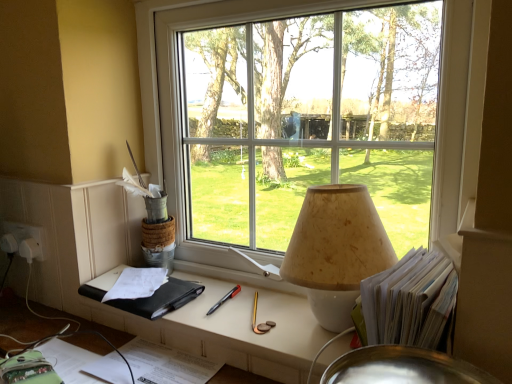
In order to face beige textured lampshade at center, should I rotate leftwards or rightwards?

To align with it, rotate right about 10.952°.

What is the approximate width of beige textured lampshade at center?

8.10 inches.

From the picture: Measure the distance between white paper stack at right and camera.

white paper stack at right is 21.95 inches from camera.

This screenshot has height=384, width=512. Find the location of `transparent glass window at center`. transparent glass window at center is located at coordinates (310, 119).

Are beige textured lampshade at center and white paper stack at right far apart?

No, there isn't a large distance between beige textured lampshade at center and white paper stack at right.

Considering the relative sizes of beige textured lampshade at center and white paper stack at right in the image provided, is beige textured lampshade at center wider than white paper stack at right?

Indeed, beige textured lampshade at center has a greater width compared to white paper stack at right.

Between beige textured lampshade at center and white paper stack at right, which one has more height?

beige textured lampshade at center is taller.

Find the location of a particular element. lamp on the left of white paper stack at right is located at coordinates (336, 250).

Considering the positions of point (325, 226) and point (446, 202), is point (325, 226) closer or farther from the camera than point (446, 202)?

Clearly, point (325, 226) is closer to the camera than point (446, 202).

Which is correct: beige textured lampshade at center is inside transparent glass window at center, or outside of it?

beige textured lampshade at center is not enclosed by transparent glass window at center.

From the image's perspective, who appears lower, beige textured lampshade at center or transparent glass window at center?

From the image's view, beige textured lampshade at center is below.

Visually, is beige textured lampshade at center positioned to the left or to the right of transparent glass window at center?

In the image, beige textured lampshade at center appears on the right side of transparent glass window at center.

Considering the relative sizes of transparent glass window at center and black leather notebook at lower left in the image provided, is transparent glass window at center bigger than black leather notebook at lower left?

Indeed, transparent glass window at center has a larger size compared to black leather notebook at lower left.

Considering the sizes of objects transparent glass window at center and black leather notebook at lower left in the image provided, who is wider, transparent glass window at center or black leather notebook at lower left?

Wider between the two is black leather notebook at lower left.

Would you say transparent glass window at center is inside or outside black leather notebook at lower left?

transparent glass window at center is located beyond the bounds of black leather notebook at lower left.

Between transparent glass window at center and black leather notebook at lower left, which one has less height?

black leather notebook at lower left is shorter.

Who is shorter, beige textured lampshade at center or black leather notebook at lower left?

Standing shorter between the two is black leather notebook at lower left.

From a real-world perspective, is beige textured lampshade at center over black leather notebook at lower left?

Yes, from a real-world perspective, beige textured lampshade at center is on top of black leather notebook at lower left.

From the image's perspective, is beige textured lampshade at center located above black leather notebook at lower left?

Yes, from the image's perspective, beige textured lampshade at center is on top of black leather notebook at lower left.

Choose the correct answer: Is beige textured lampshade at center inside black leather notebook at lower left or outside it?

beige textured lampshade at center is not inside black leather notebook at lower left, it's outside.

You are a GUI agent. You are given a task and a screenshot of the screen. Output one action in this format:
    pyautogui.click(x=<x>, y=<y>)
    Task: Click on the notebook on the left of transparent glass window at center
    The image size is (512, 384).
    Given the screenshot: What is the action you would take?
    pyautogui.click(x=161, y=299)

Which of these two, black leather notebook at lower left or transparent glass window at center, is thinner?

transparent glass window at center.

Is black leather notebook at lower left located outside transparent glass window at center?

black leather notebook at lower left is positioned outside transparent glass window at center.

Which is more to the right, transparent glass window at center or matte black book at center?

transparent glass window at center is more to the right.

Considering the sizes of objects transparent glass window at center and matte black book at center in the image provided, who is thinner, transparent glass window at center or matte black book at center?

Thinner between the two is transparent glass window at center.

How distant is transparent glass window at center from matte black book at center?

They are 12.39 inches apart.

Is point (384, 20) closer or farther from the camera than point (184, 332)?

Point (384, 20) is farther from the camera than point (184, 332).

From a real-world perspective, is black leather notebook at lower left physically below matte black book at center?

No, from a real-world perspective, black leather notebook at lower left is not below matte black book at center.

From the image's perspective, who appears lower, black leather notebook at lower left or matte black book at center?

matte black book at center is shown below in the image.

Is black leather notebook at lower left oriented towards matte black book at center?

No, black leather notebook at lower left does not turn towards matte black book at center.

At what (x,y) coordinates should I click in order to perform the action: click on table beneath the black leather notebook at lower left (from a real-world perspective). Please return your answer as a coordinate pair (x, y). This screenshot has width=512, height=384. Looking at the image, I should click on (234, 329).

Locate an element on the screen. This screenshot has height=384, width=512. book below the beige textured lampshade at center (from the image's perspective) is located at coordinates (410, 300).

Where is `window above the beige textured lampshade at center (from the image's perspective)`? The image size is (512, 384). window above the beige textured lampshade at center (from the image's perspective) is located at coordinates (310, 119).

From the image, which object appears to be nearer to black leather notebook at lower left, transparent glass window at center or white paper stack at right?

transparent glass window at center is closer to black leather notebook at lower left.

Considering their positions, is white paper stack at right positioned closer to matte black book at center than beige textured lampshade at center?

The object closer to matte black book at center is beige textured lampshade at center.

Based on their spatial positions, is transparent glass window at center or black leather notebook at lower left closer to beige textured lampshade at center?

Among the two, transparent glass window at center is located nearer to beige textured lampshade at center.

From the image, which object appears to be nearer to white paper stack at right, matte black book at center or black leather notebook at lower left?

matte black book at center is positioned closer to the anchor white paper stack at right.

Estimate the real-world distances between objects in this image. Which object is further from transparent glass window at center, white paper stack at right or matte black book at center?

white paper stack at right.

When comparing their distances from matte black book at center, does white paper stack at right or transparent glass window at center seem closer?

Based on the image, white paper stack at right appears to be nearer to matte black book at center.

Looking at the image, which one is located closer to white paper stack at right, transparent glass window at center or black leather notebook at lower left?

The object closer to white paper stack at right is transparent glass window at center.

Looking at the image, which one is located closer to beige textured lampshade at center, transparent glass window at center or white paper stack at right?

white paper stack at right is positioned closer to the anchor beige textured lampshade at center.

Locate an element on the screen. The image size is (512, 384). window between black leather notebook at lower left and white paper stack at right in the horizontal direction is located at coordinates 310,119.

Identify the location of lamp between matte black book at center and white paper stack at right from left to right. (336, 250).

Image resolution: width=512 pixels, height=384 pixels. Identify the location of lamp between transparent glass window at center and matte black book at center vertically. (336, 250).

Find the location of a particular element. The width and height of the screenshot is (512, 384). lamp between transparent glass window at center and white paper stack at right in the vertical direction is located at coordinates pyautogui.click(x=336, y=250).